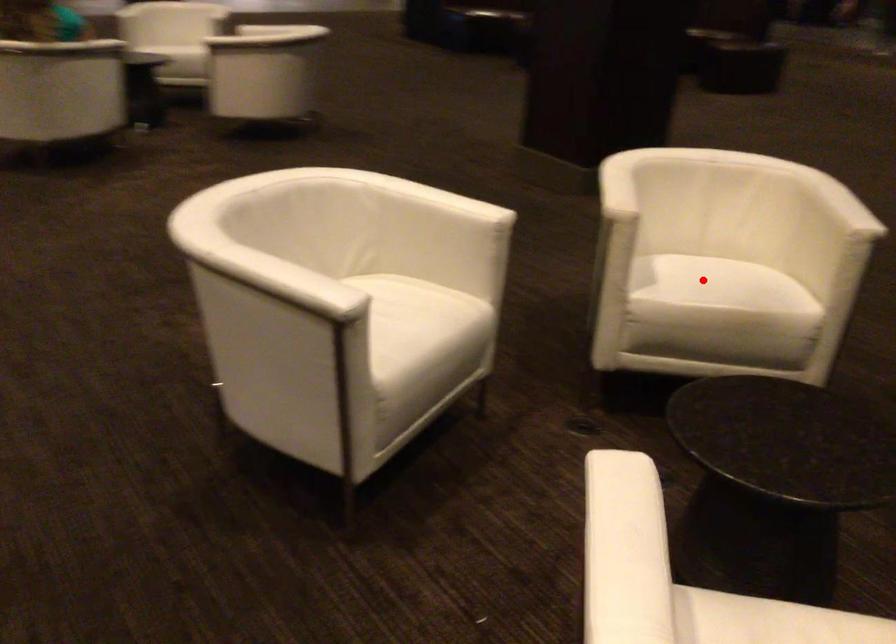
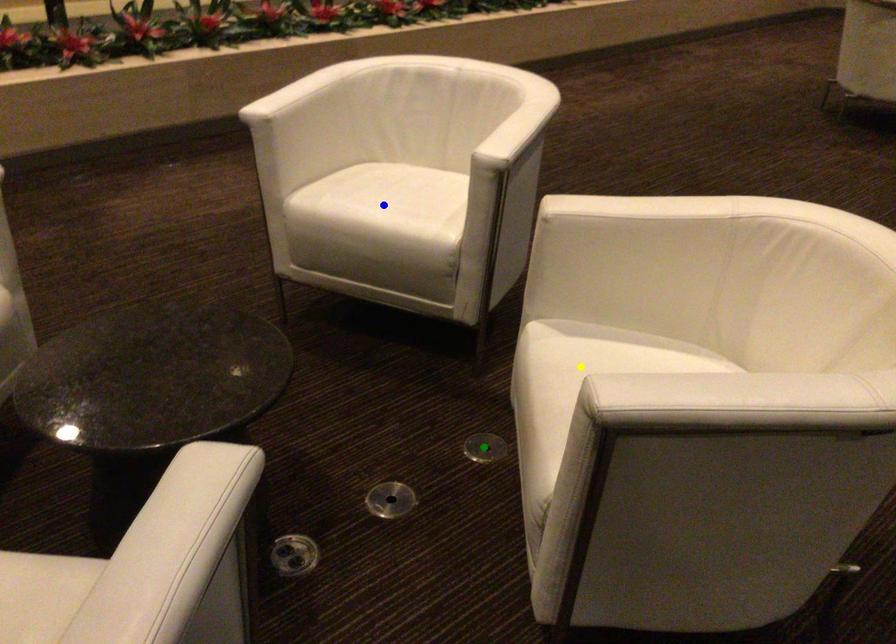
Question: I am providing you with two images of the same scene from different viewpoints. A red point is marked on the first image. You are given multiple points on the second image. In image 2, which mark is for the same physical point as the one in image 1?

Choices:
 (A) yellow point
 (B) blue point
 (C) green point

Answer: (A)